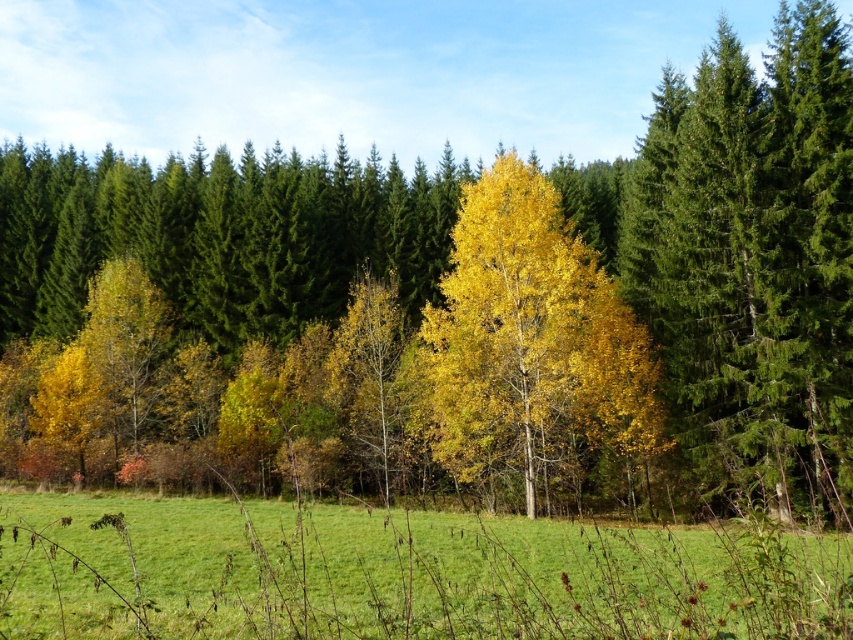
Question: Which of the following is the closest to the observer?

Choices:
 (A) (537, 241)
 (B) (206, 625)

Answer: (B)

Question: Is green grass at center behind yellow/golden leaves at center?

Choices:
 (A) no
 (B) yes

Answer: (A)

Question: Can you confirm if green grass at center is positioned below yellow/golden leaves at center?

Choices:
 (A) yes
 (B) no

Answer: (A)

Question: Which point is closer to the camera?

Choices:
 (A) yellow/golden leaves at center
 (B) green grass at center

Answer: (B)

Question: Is green grass at center above yellow/golden leaves at center?

Choices:
 (A) yes
 (B) no

Answer: (B)